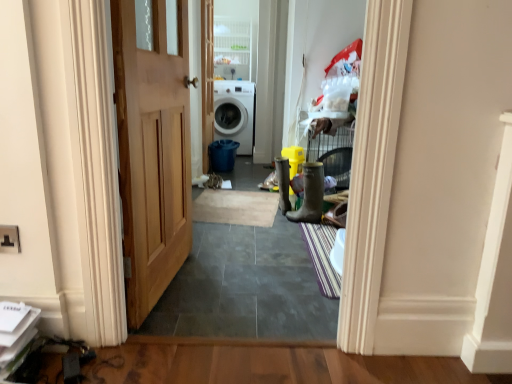
Question: Considering the positions of striped fabric doormat at center, placed as the 1th doormat when sorted from bottom to top, and beige carpet at center, which is the 2th doormat in front-to-back order, in the image, is striped fabric doormat at center, placed as the 1th doormat when sorted from bottom to top, bigger or smaller than beige carpet at center, which is the 2th doormat in front-to-back order,?

Choices:
 (A) small
 (B) big

Answer: (A)

Question: From the image's perspective, is striped fabric doormat at center, the first doormat positioned from the front, located above or below beige carpet at center, acting as the 1th doormat starting from the back?

Choices:
 (A) above
 (B) below

Answer: (B)

Question: Which of these objects is positioned closest to the wooden door at left?

Choices:
 (A) rubber boot at center, which appears as the 2th boot when viewed from the front
 (B) rubber/matte boot at right, the first boot when ordered from right to left
 (C) striped fabric doormat at center, marked as the 1th doormat in a right-to-left arrangement
 (D) white plastic cabinet at upper center
 (E) beige carpet at center, the second doormat positioned from the bottom

Answer: (C)

Question: Which object is positioned farthest from the white plastic cabinet at upper center?

Choices:
 (A) wooden door at left
 (B) striped fabric doormat at center, the 2th doormat in the top-to-bottom sequence
 (C) rubber boot at center, the first boot in the back-to-front sequence
 (D) white glossy washing machine at center
 (E) rubber/matte boot at right, which is counted as the second boot, starting from the back

Answer: (A)